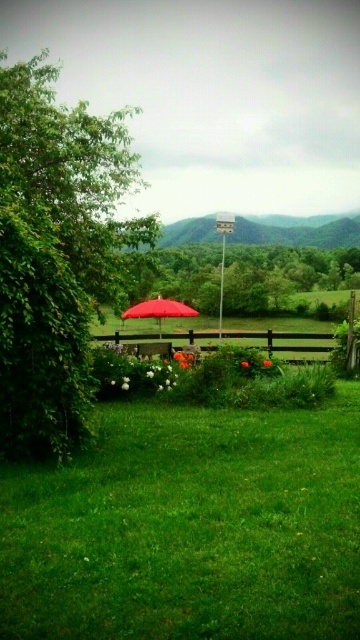
Please provide the coordinates of the green leafy tree at center in the image. The coordinate system is normalized, with the origin at the bottom left corner of the image. The x and y axes are measured in normalized units between 0 and 1. Please format your answer as a tuple of two decimal numbers, rounded to three decimal places.

The coordinates of the green leafy tree at center are at point (282, 276).

You are standing in the backyard and want to walk from the wooden bench to the red umbrella. Which tree, the green leafy tree at left or the green leafy tree at center, will block your path more?

The green leafy tree at left is in front of green leafy tree at center, so it will block your path more when walking from the wooden bench to the red umbrella.

You are planning to install a bird feeder in your backyard. You have two options for placement locations. One is near the green leafy tree at left and the other is near the green leafy tree at center. Which tree would you choose if you want the bird feeder to be higher up?

The green leafy tree at left has a greater height compared to the green leafy tree at center, so you should choose the green leafy tree at left to place the bird feeder if you want it higher up.